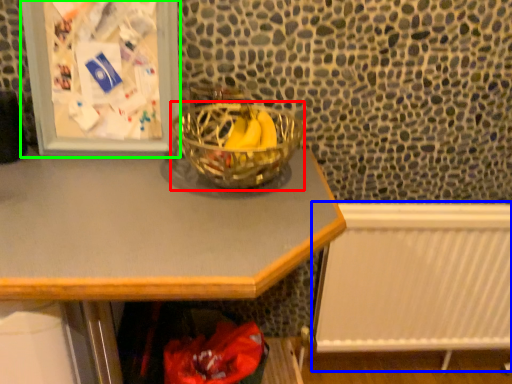
Question: Which object is the closest to the glass bowl (highlighted by a red box)? Choose among these: radiator (highlighted by a blue box) or picture frame (highlighted by a green box).

Choices:
 (A) radiator
 (B) picture frame

Answer: (B)